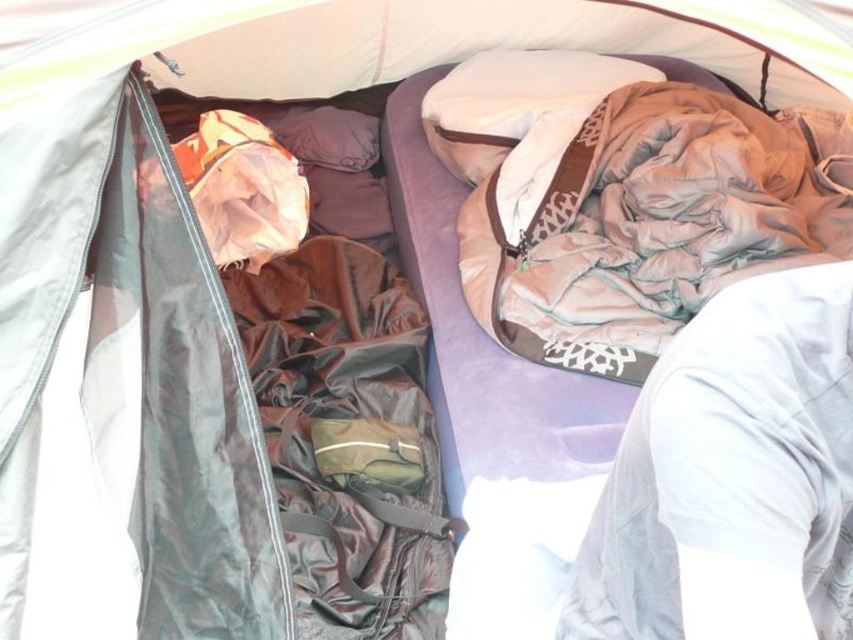
Question: Can you confirm if white fabric at lower right is positioned below orange fabric bag at left?

Choices:
 (A) yes
 (B) no

Answer: (A)

Question: Does brown fabric bag at center have a larger size compared to white soft pillow at upper center?

Choices:
 (A) no
 (B) yes

Answer: (B)

Question: Based on their relative distances, which object is nearer to the orange fabric bag at left?

Choices:
 (A) brown fabric bag at center
 (B) brown/cotton-blend blanket at upper right
 (C) white fabric at lower right

Answer: (A)

Question: Among these objects, which one is nearest to the camera?

Choices:
 (A) brown/cotton-blend blanket at upper right
 (B) white fabric at lower right

Answer: (B)

Question: Which point is closer to the camera?

Choices:
 (A) brown fabric bag at center
 (B) orange fabric bag at left
 (C) brown/cotton-blend blanket at upper right

Answer: (A)

Question: Does brown/cotton-blend blanket at upper right appear on the right side of brown fabric bag at center?

Choices:
 (A) no
 (B) yes

Answer: (B)